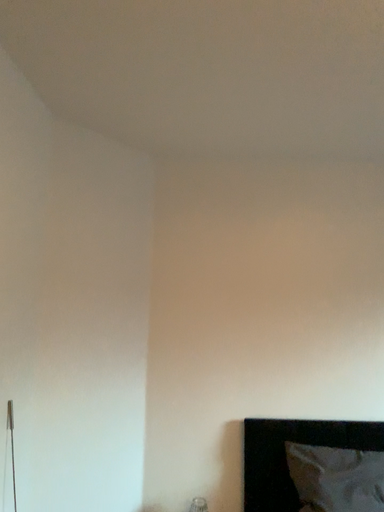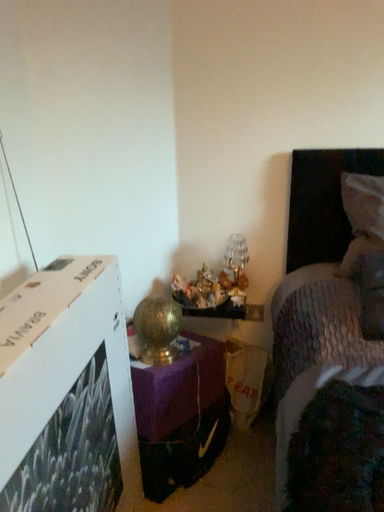
Question: How did the camera likely rotate when shooting the video?

Choices:
 (A) rotated upward
 (B) rotated downward

Answer: (B)